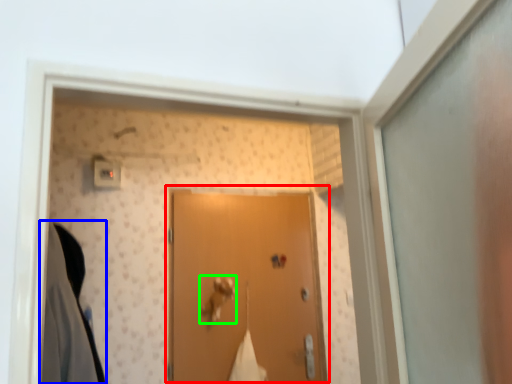
Question: Based on their relative distances, which object is farther from door (highlighted by a red box)? Choose from clothing (highlighted by a blue box) and door handle (highlighted by a green box).

Choices:
 (A) clothing
 (B) door handle

Answer: (A)